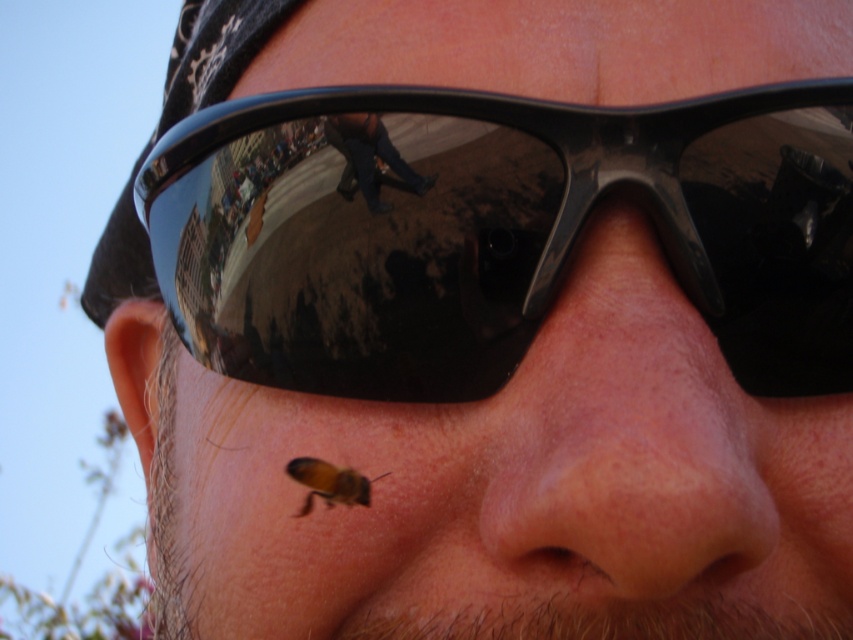
Can you confirm if pink smooth skin at center is smaller than brown fuzzy bee at lower right?

No.

Does pink smooth skin at center appear over brown fuzzy bee at lower right?

Correct, pink smooth skin at center is located above brown fuzzy bee at lower right.

Which is in front, point (691, 339) or point (334, 476)?

Positioned in front is point (691, 339).

Locate an element on the screen. pink smooth skin at center is located at coordinates (624, 436).

Does black reflective sunglasses at upper center appear on the right side of pink smooth skin at center?

No, black reflective sunglasses at upper center is not to the right of pink smooth skin at center.

Describe the element at coordinates (492, 230) in the screenshot. I see `black reflective sunglasses at upper center` at that location.

This screenshot has height=640, width=853. I want to click on black reflective sunglasses at upper center, so coord(492,230).

Can you confirm if black reflective sunglasses at upper center is taller than brown fuzzy bee at lower right?

Correct, black reflective sunglasses at upper center is much taller as brown fuzzy bee at lower right.

You are a GUI agent. You are given a task and a screenshot of the screen. Output one action in this format:
    pyautogui.click(x=<x>, y=<y>)
    Task: Click on the black reflective sunglasses at upper center
    This screenshot has height=640, width=853.
    Given the screenshot: What is the action you would take?
    pyautogui.click(x=492, y=230)

Which is behind, point (844, 314) or point (340, 497)?

The point (844, 314) is more distant.

Where is `black reflective sunglasses at upper center`? black reflective sunglasses at upper center is located at coordinates (492, 230).